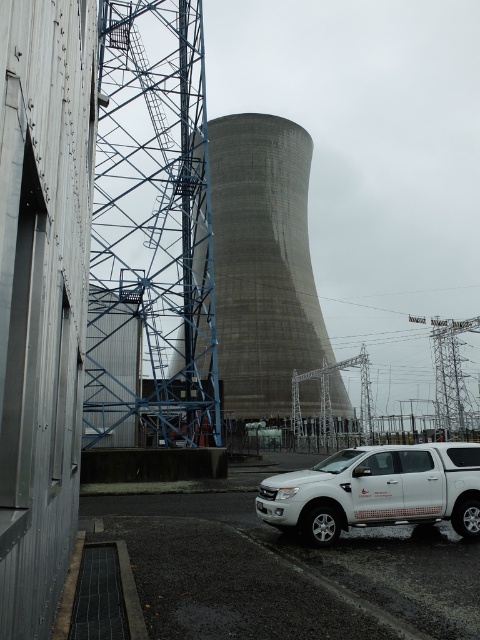
Question: Can you confirm if gray concrete cooling tower at center is positioned below white matte truck at lower right?

Choices:
 (A) no
 (B) yes

Answer: (A)

Question: Which point is farther to the camera?

Choices:
 (A) [385, 490]
 (B) [192, 417]

Answer: (B)

Question: Can you confirm if gray concrete cooling tower at center is positioned above white matte truck at lower right?

Choices:
 (A) yes
 (B) no

Answer: (A)

Question: Is blue metallic tower at left below white matte truck at lower right?

Choices:
 (A) yes
 (B) no

Answer: (B)

Question: Considering the real-world distances, which object is farthest from the white matte truck at lower right?

Choices:
 (A) blue metallic tower at left
 (B) gray concrete cooling tower at center

Answer: (B)

Question: Which point is closer to the camera?

Choices:
 (A) white matte truck at lower right
 (B) blue metallic tower at left

Answer: (A)